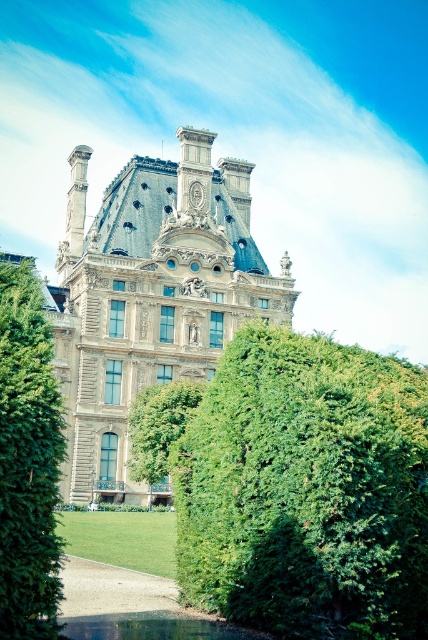
Measure the distance between point (154, 422) and camera.

Point (154, 422) and camera are 69.83 meters apart.

Which is below, green leafy tree at center or green grassy pond at lower center?

green grassy pond at lower center is below.

Consider the image. Who is more forward, (145, 400) or (222, 625)?

Point (222, 625)

This screenshot has height=640, width=428. Identify the location of green leafy tree at center. (158, 428).

In the scene shown: Who is positioned more to the left, green leafy tree at left or green grassy pond at lower center?

Positioned to the left is green leafy tree at left.

Between point (38, 515) and point (82, 625), which one is positioned behind?

The point (82, 625) is more distant.

Between point (29, 616) and point (95, 624), which one is positioned in front?

Point (29, 616) is more forward.

Locate an element on the screen. Image resolution: width=428 pixels, height=640 pixels. green leafy tree at left is located at coordinates (27, 461).

Who is positioned more to the right, green leafy bush at center or green grassy pond at lower center?

Positioned to the right is green leafy bush at center.

Which is in front, point (299, 378) or point (95, 625)?

Positioned in front is point (95, 625).

Locate an element on the screen. green leafy bush at center is located at coordinates (x=306, y=490).